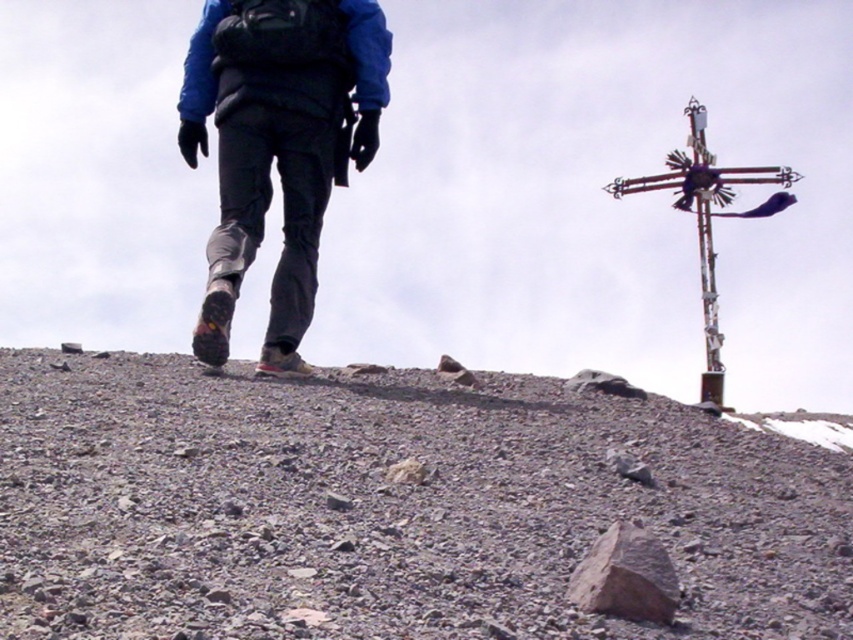
You are the hiker in the scene. You need to step on the brown rough rock at lower center to avoid a patch of mud. Can your matte black pants at center cover the entire rock when you step on it?

The matte black pants at center has a larger width than the brown rough rock at lower center, so yes, the matte black pants at center can cover the entire brown rough rock at lower center when stepping on it.

You are the hiker in the scene. You want to place a small backpack on the ground between your matte black pants at center and the rusty metal cross at upper right. Based on their positions, which object should the backpack be closer to?

The backpack should be placed closer to the rusty metal cross at upper right because the matte black pants at center is positioned on the left side of rusty metal cross at upper right, meaning the cross is to the right of the pants. Therefore, the midpoint between them would be closer to the cross if the pants are on its left.

You are a hiker trying to reach the summit marker. From your current position, which object is closer to you, the matte black pants at center or the rusty metal cross at upper right?

The matte black pants at center is shorter than the rusty metal cross at upper right, so the matte black pants at center is closer to you.